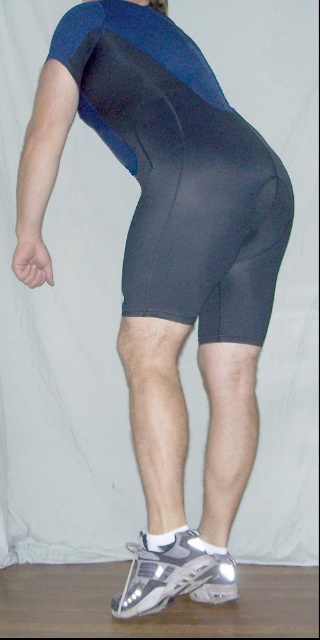
Question: In this image, where is black matte shorts at center located relative to matte gray shorts at lower center?

Choices:
 (A) right
 (B) left

Answer: (A)

Question: Does black matte shorts at center come in front of matte gray shorts at lower center?

Choices:
 (A) yes
 (B) no

Answer: (A)

Question: Does black matte shorts at center appear under matte gray shorts at lower center?

Choices:
 (A) no
 (B) yes

Answer: (A)

Question: Which point is farther from the camera taking this photo?

Choices:
 (A) (192, 568)
 (B) (140, 211)

Answer: (A)

Question: Which of the following is the farthest from the observer?

Choices:
 (A) (122, 358)
 (B) (176, 166)

Answer: (A)